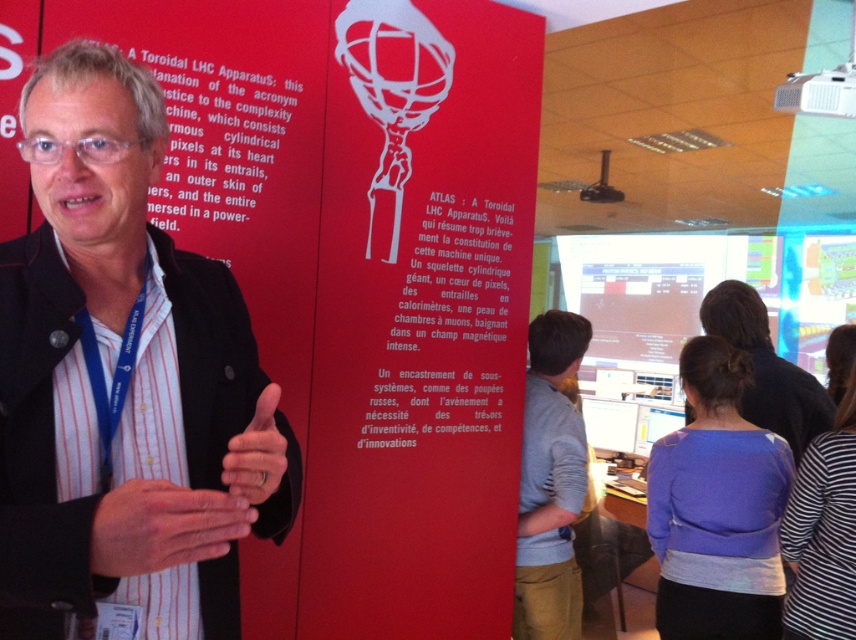
Question: Can you confirm if black matte jacket at left is wider than matte black hand at center?

Choices:
 (A) yes
 (B) no

Answer: (A)

Question: Among these objects, which one is farthest from the camera?

Choices:
 (A) gray cotton shirt at center
 (B) matte black shirt at center

Answer: (B)

Question: Which object is positioned farthest from the black matte jacket at left?

Choices:
 (A) gray cotton shirt at center
 (B) smooth skin hand at center
 (C) matte black shirt at center
 (D) matte black hand at center

Answer: (C)

Question: From the image, what is the correct spatial relationship of smooth skin hand at center in relation to matte black hand at center?

Choices:
 (A) above
 (B) below

Answer: (B)

Question: Does black matte jacket at left have a lesser width compared to matte black shirt at center?

Choices:
 (A) no
 (B) yes

Answer: (B)

Question: Which point appears closest to the camera in this image?

Choices:
 (A) (94, 72)
 (B) (235, 474)
 (C) (765, 406)

Answer: (B)